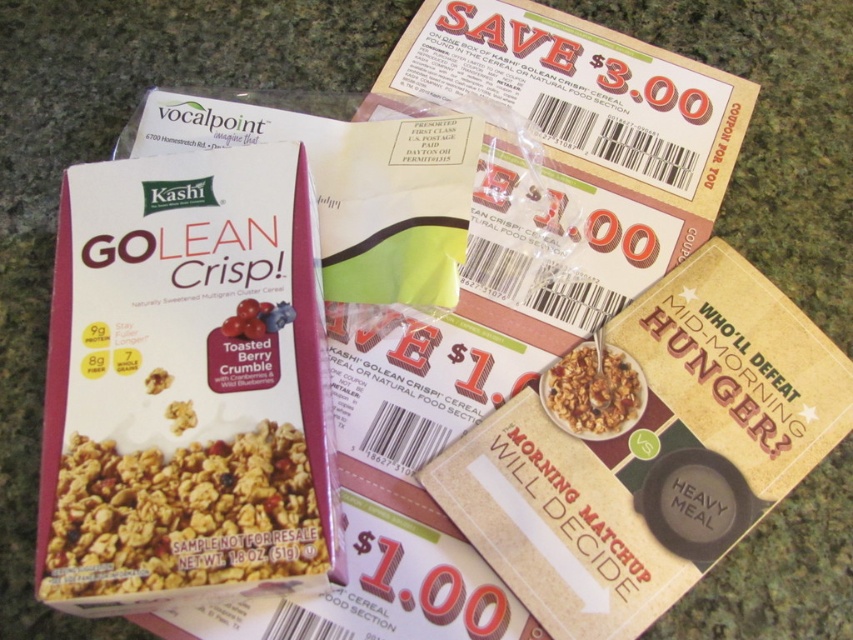
Looking at this image, between matte brown granola at center and granular textured cereal at center, which one is positioned lower?

Positioned lower is matte brown granola at center.

Can you confirm if matte brown granola at center is taller than granular textured cereal at center?

Indeed, matte brown granola at center has a greater height compared to granular textured cereal at center.

Who is more distant from viewer, (56, 504) or (564, 412)?

Positioned behind is point (564, 412).

The width and height of the screenshot is (853, 640). I want to click on matte brown granola at center, so click(x=183, y=515).